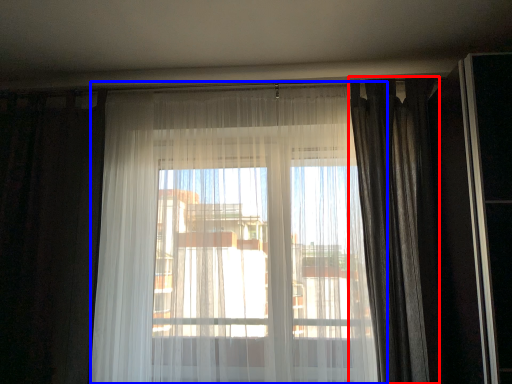
Question: Among these objects, which one is farthest to the camera, curtain (highlighted by a red box) or curtain (highlighted by a blue box)?

Choices:
 (A) curtain
 (B) curtain

Answer: (A)